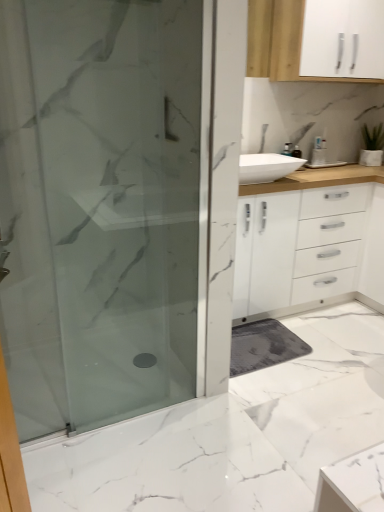
What do you see at coordinates (99, 208) in the screenshot?
I see `frosted glass shower door at left` at bounding box center [99, 208].

Locate an element on the screen. frosted glass shower door at left is located at coordinates (99, 208).

What do you see at coordinates (279, 42) in the screenshot? I see `white matte cabinet at upper right` at bounding box center [279, 42].

Where is `white matte cabinet at upper right`? The width and height of the screenshot is (384, 512). white matte cabinet at upper right is located at coordinates (279, 42).

This screenshot has height=512, width=384. I want to click on frosted glass shower door at left, so click(99, 208).

In the image, is frosted glass shower door at left on the left side or the right side of white matte cabinet at upper right?

frosted glass shower door at left is positioned on white matte cabinet at upper right's left side.

Is frosted glass shower door at left behind white matte cabinet at upper right?

No, it is not.

Considering the points (118, 267) and (250, 69), which point is in front, point (118, 267) or point (250, 69)?

Point (118, 267)

From the image's perspective, is frosted glass shower door at left located above or below white matte cabinet at upper right?

Based on their image positions, frosted glass shower door at left is located beneath white matte cabinet at upper right.

From a real-world perspective, is frosted glass shower door at left under white matte cabinet at upper right?

Yes, from a real-world perspective, frosted glass shower door at left is under white matte cabinet at upper right.

Is frosted glass shower door at left thinner than white matte cabinet at upper right?

Yes.

Who is taller, frosted glass shower door at left or white matte cabinet at upper right?

With more height is frosted glass shower door at left.

Who is bigger, frosted glass shower door at left or white matte cabinet at upper right?

With larger size is white matte cabinet at upper right.

Is frosted glass shower door at left surrounding white matte cabinet at upper right?

Actually, white matte cabinet at upper right is outside frosted glass shower door at left.

Is frosted glass shower door at left beside white matte cabinet at upper right?

frosted glass shower door at left is not next to white matte cabinet at upper right, and they're not touching.

Is frosted glass shower door at left positioned with its back to white matte cabinet at upper right?

No, white matte cabinet at upper right is not at the back of frosted glass shower door at left.

Can you tell me how much frosted glass shower door at left and white matte cabinet at upper right differ in facing direction?

2.74 degrees separate the facing orientations of frosted glass shower door at left and white matte cabinet at upper right.

Find the location of a particular element. Image resolution: width=384 pixels, height=512 pixels. shower door that is on the left side of white matte cabinet at upper right is located at coordinates (99, 208).

Considering the relative positions of white matte cabinet at upper right and frosted glass shower door at left in the image provided, is white matte cabinet at upper right to the left of frosted glass shower door at left from the viewer's perspective?

No, white matte cabinet at upper right is not to the left of frosted glass shower door at left.

Is the position of white matte cabinet at upper right more distant than that of frosted glass shower door at left?

That is True.

Does point (247, 54) come in front of point (84, 37)?

No, (247, 54) is further to viewer.

From the image's perspective, who appears lower, white matte cabinet at upper right or frosted glass shower door at left?

frosted glass shower door at left, from the image's perspective.

From a real-world perspective, is white matte cabinet at upper right beneath frosted glass shower door at left?

Incorrect, from a real-world perspective, white matte cabinet at upper right is higher than frosted glass shower door at left.

In terms of width, does white matte cabinet at upper right look wider or thinner when compared to frosted glass shower door at left?

white matte cabinet at upper right is wider than frosted glass shower door at left.

Who is shorter, white matte cabinet at upper right or frosted glass shower door at left?

white matte cabinet at upper right is shorter.

Considering the sizes of objects white matte cabinet at upper right and frosted glass shower door at left in the image provided, who is bigger, white matte cabinet at upper right or frosted glass shower door at left?

Result: white matte cabinet at upper right is bigger.

Is frosted glass shower door at left located within white matte cabinet at upper right?

No, frosted glass shower door at left is located outside of white matte cabinet at upper right.

Consider the image. Are white matte cabinet at upper right and frosted glass shower door at left located far from each other?

Indeed, white matte cabinet at upper right is not near frosted glass shower door at left.

Is white matte cabinet at upper right facing towards frosted glass shower door at left?

No, white matte cabinet at upper right is not facing towards frosted glass shower door at left.

How distant is white matte cabinet at upper right from frosted glass shower door at left?

They are 1.22 meters apart.

Locate an element on the screen. cabinetry positioned vertically above the frosted glass shower door at left (from a real-world perspective) is located at coordinates (279, 42).

Find the location of a particular element. The image size is (384, 512). shower door that is on the left side of white matte cabinet at upper right is located at coordinates (99, 208).

There is a frosted glass shower door at left. Find the location of `cabinetry above it (from a real-world perspective)`. cabinetry above it (from a real-world perspective) is located at coordinates (279, 42).